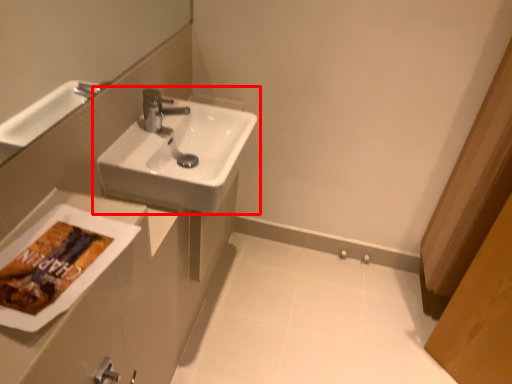
Question: Observing the image, what is the correct spatial positioning of sink (annotated by the red box) in reference to porcelain?

Choices:
 (A) right
 (B) left

Answer: (B)